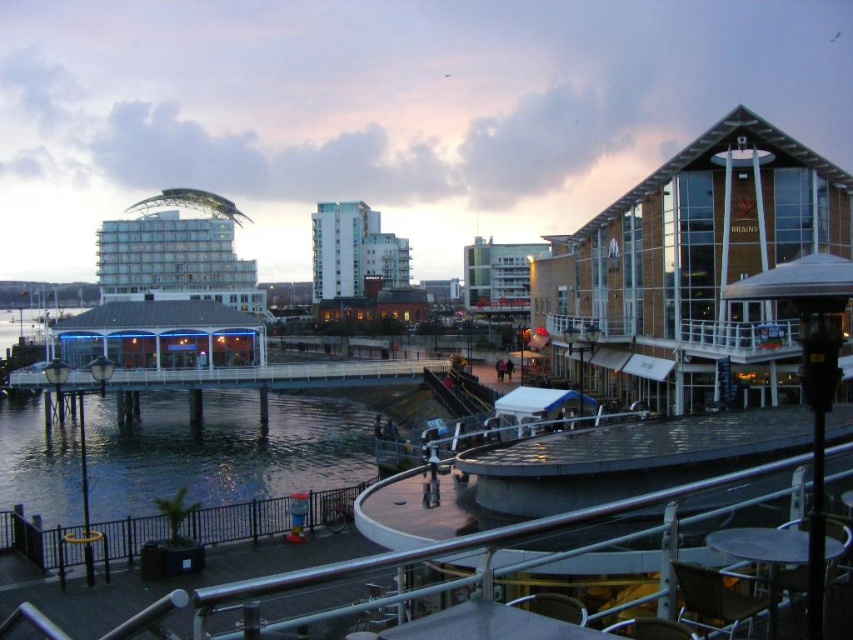
Is clear water at lower left positioned in front of black metal railing at lower left?

That is False.

Between point (331, 433) and point (140, 525), which one is positioned in front?

Point (140, 525) is more forward.

This screenshot has height=640, width=853. I want to click on clear water at lower left, so click(223, 464).